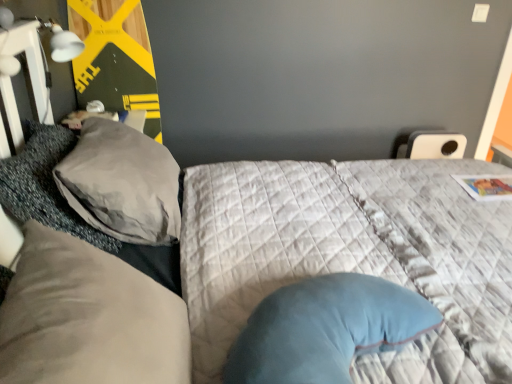
What do you see at coordinates (88, 318) in the screenshot? The image size is (512, 384). I see `suede-like beige pillow at left, which is the third pillow in back-to-front order` at bounding box center [88, 318].

In order to face suede-like beige pillow at left, which is the third pillow in back-to-front order, should I rotate leftwards or rightwards?

You should rotate left by 19.261 degrees.

Image resolution: width=512 pixels, height=384 pixels. What do you see at coordinates (45, 185) in the screenshot? I see `gray textured pillow at left, the second pillow positioned from the back` at bounding box center [45, 185].

Identify the location of matte yellow wood board at upper left. [115, 58].

This screenshot has height=384, width=512. What do you see at coordinates (352, 256) in the screenshot?
I see `velvety blue pillow at center` at bounding box center [352, 256].

The image size is (512, 384). I want to click on velvety blue pillow at center, so click(352, 256).

Measure the distance between point (123, 191) and camera.

Point (123, 191) is 1.27 meters from camera.

What do you see at coordinates (122, 183) in the screenshot? The width and height of the screenshot is (512, 384). I see `gray fabric pillow at left, the first pillow in the back-to-front sequence` at bounding box center [122, 183].

Find the location of a particular element. This screenshot has width=512, height=384. suede-like beige pillow at left, the first pillow from the front is located at coordinates (88, 318).

Is matte yellow wood board at upper left oriented away from velvety blue pillow at center?

matte yellow wood board at upper left is not turned away from velvety blue pillow at center.

From a real-world perspective, is matte yellow wood board at upper left below velvety blue pillow at center?

Incorrect, from a real-world perspective, matte yellow wood board at upper left is higher than velvety blue pillow at center.

Would you say velvety blue pillow at center is part of matte yellow wood board at upper left's contents?

No, velvety blue pillow at center is not surrounded by matte yellow wood board at upper left.

Consider the image. Are matte yellow wood board at upper left and velvety blue pillow at center beside each other?

Result: matte yellow wood board at upper left and velvety blue pillow at center are not in contact.

Is suede-like beige pillow at left, which is the third pillow in back-to-front order, touching gray textured pillow at left, the second pillow positioned from the back?

suede-like beige pillow at left, which is the third pillow in back-to-front order, and gray textured pillow at left, the second pillow positioned from the back, are clearly separated.

In the scene shown: From the image's perspective, is suede-like beige pillow at left, the first pillow from the front, on gray textured pillow at left, which is the second pillow in front-to-back order?

No, from the image's perspective, suede-like beige pillow at left, the first pillow from the front, is not on top of gray textured pillow at left, which is the second pillow in front-to-back order.

Can you confirm if gray textured pillow at left, the second pillow positioned from the back, is shorter than velvety blue pillow at center?

In fact, gray textured pillow at left, the second pillow positioned from the back, may be taller than velvety blue pillow at center.

How distant is gray textured pillow at left, the second pillow positioned from the back, from velvety blue pillow at center?

gray textured pillow at left, the second pillow positioned from the back, and velvety blue pillow at center are 26.71 inches apart.

Considering the relative sizes of gray textured pillow at left, which is the second pillow in front-to-back order, and velvety blue pillow at center in the image provided, is gray textured pillow at left, which is the second pillow in front-to-back order, thinner than velvety blue pillow at center?

Indeed, gray textured pillow at left, which is the second pillow in front-to-back order, has a lesser width compared to velvety blue pillow at center.

From the image's perspective, which is above, gray textured pillow at left, which is the second pillow in front-to-back order, or velvety blue pillow at center?

gray textured pillow at left, which is the second pillow in front-to-back order.

Does point (13, 206) lie behind point (149, 117)?

No, (13, 206) is in front of (149, 117).

Find the location of a particular element. pillow that is the 2nd object located below the matte yellow wood board at upper left (from the image's perspective) is located at coordinates (45, 185).

From the image's perspective, would you say gray textured pillow at left, the second pillow positioned from the back, is positioned over matte yellow wood board at upper left?

No, from the image's perspective, gray textured pillow at left, the second pillow positioned from the back, is not over matte yellow wood board at upper left.

Is gray textured pillow at left, the second pillow positioned from the back, wider than matte yellow wood board at upper left?

Correct, the width of gray textured pillow at left, the second pillow positioned from the back, exceeds that of matte yellow wood board at upper left.

Considering the positions of objects gray fabric pillow at left, the first pillow in the back-to-front sequence, and velvety blue pillow at center in the image provided, who is more to the right, gray fabric pillow at left, the first pillow in the back-to-front sequence, or velvety blue pillow at center?

velvety blue pillow at center is more to the right.

The image size is (512, 384). Find the location of `mattress lying in front of the gray fabric pillow at left, the first pillow in the back-to-front sequence`. mattress lying in front of the gray fabric pillow at left, the first pillow in the back-to-front sequence is located at coordinates (352, 256).

How different are the orientations of gray fabric pillow at left, which appears as the third pillow when viewed from the front, and velvety blue pillow at center in degrees?

The angle between the facing direction of gray fabric pillow at left, which appears as the third pillow when viewed from the front, and the facing direction of velvety blue pillow at center is 1.46 degrees.

Based on the photo, is gray fabric pillow at left, which appears as the third pillow when viewed from the front, bigger or smaller than velvety blue pillow at center?

gray fabric pillow at left, which appears as the third pillow when viewed from the front, is bigger than velvety blue pillow at center.

Locate an element on the screen. the 1st pillow below when counting from the matte yellow wood board at upper left (from the image's perspective) is located at coordinates (122, 183).

Is gray fabric pillow at left, which appears as the third pillow when viewed from the front, positioned with its back to matte yellow wood board at upper left?

gray fabric pillow at left, which appears as the third pillow when viewed from the front, is not turned away from matte yellow wood board at upper left.

Between point (137, 218) and point (126, 24), which one is positioned behind?

The point (126, 24) is farther.

Considering the sizes of gray fabric pillow at left, the first pillow in the back-to-front sequence, and matte yellow wood board at upper left in the image, is gray fabric pillow at left, the first pillow in the back-to-front sequence, taller or shorter than matte yellow wood board at upper left?

Considering their sizes, gray fabric pillow at left, the first pillow in the back-to-front sequence, has less height than matte yellow wood board at upper left.

Considering the relative sizes of matte yellow wood board at upper left and suede-like beige pillow at left, which is the third pillow in back-to-front order, in the image provided, is matte yellow wood board at upper left thinner than suede-like beige pillow at left, which is the third pillow in back-to-front order,?

Yes.

Is point (140, 74) closer to camera compared to point (139, 287)?

No, it is behind (139, 287).

Is matte yellow wood board at upper left turned away from suede-like beige pillow at left, the first pillow from the front?

matte yellow wood board at upper left does not have its back to suede-like beige pillow at left, the first pillow from the front.

This screenshot has height=384, width=512. I want to click on bulletin board above the suede-like beige pillow at left, the first pillow from the front (from a real-world perspective), so click(x=115, y=58).

I want to click on mattress located below the matte yellow wood board at upper left (from the image's perspective), so click(352, 256).

You are a GUI agent. You are given a task and a screenshot of the screen. Output one action in this format:
    pyautogui.click(x=<x>, y=<y>)
    Task: Click on the 2nd pillow positioned below the suede-like beige pillow at left, which is the third pillow in back-to-front order (from a real-world perspective)
    Image resolution: width=512 pixels, height=384 pixels.
    Given the screenshot: What is the action you would take?
    pyautogui.click(x=45, y=185)

Looking at the image, which one is located further to velvety blue pillow at center, gray textured pillow at left, which is the second pillow in front-to-back order, or matte yellow wood board at upper left?

The object further to velvety blue pillow at center is matte yellow wood board at upper left.

From the image, which object appears to be nearer to velvety blue pillow at center, gray fabric pillow at left, the first pillow in the back-to-front sequence, or gray textured pillow at left, which is the second pillow in front-to-back order?

Among the two, gray fabric pillow at left, the first pillow in the back-to-front sequence, is located nearer to velvety blue pillow at center.

From the image, which object appears to be nearer to gray textured pillow at left, which is the second pillow in front-to-back order, suede-like beige pillow at left, which is the third pillow in back-to-front order, or matte yellow wood board at upper left?

Based on the image, suede-like beige pillow at left, which is the third pillow in back-to-front order, appears to be nearer to gray textured pillow at left, which is the second pillow in front-to-back order.

Estimate the real-world distances between objects in this image. Which object is closer to velvety blue pillow at center, gray fabric pillow at left, the first pillow in the back-to-front sequence, or suede-like beige pillow at left, the first pillow from the front?

gray fabric pillow at left, the first pillow in the back-to-front sequence, is closer to velvety blue pillow at center.

When comparing their distances from matte yellow wood board at upper left, does suede-like beige pillow at left, which is the third pillow in back-to-front order, or gray fabric pillow at left, the first pillow in the back-to-front sequence, seem further?

The object further to matte yellow wood board at upper left is suede-like beige pillow at left, which is the third pillow in back-to-front order.

From the image, which object appears to be nearer to gray fabric pillow at left, which appears as the third pillow when viewed from the front, velvety blue pillow at center or suede-like beige pillow at left, the first pillow from the front?

velvety blue pillow at center is closer to gray fabric pillow at left, which appears as the third pillow when viewed from the front.

From the image, which object appears to be nearer to velvety blue pillow at center, suede-like beige pillow at left, which is the third pillow in back-to-front order, or matte yellow wood board at upper left?

suede-like beige pillow at left, which is the third pillow in back-to-front order, is closer to velvety blue pillow at center.

Considering their positions, is gray fabric pillow at left, the first pillow in the back-to-front sequence, positioned further to gray textured pillow at left, which is the second pillow in front-to-back order, than velvety blue pillow at center?

Among the two, velvety blue pillow at center is located further to gray textured pillow at left, which is the second pillow in front-to-back order.

You are a GUI agent. You are given a task and a screenshot of the screen. Output one action in this format:
    pyautogui.click(x=<x>, y=<y>)
    Task: Click on the pillow between gray textured pillow at left, which is the second pillow in front-to-back order, and matte yellow wood board at upper left in the front-back direction
    
    Given the screenshot: What is the action you would take?
    pyautogui.click(x=122, y=183)

This screenshot has width=512, height=384. What are the coordinates of `pillow between gray fabric pillow at left, the first pillow in the back-to-front sequence, and velvety blue pillow at center` in the screenshot? It's located at (88, 318).

Find the location of a particular element. This screenshot has width=512, height=384. mattress between suede-like beige pillow at left, the first pillow from the front, and matte yellow wood board at upper left in the front-back direction is located at coordinates (352, 256).

Image resolution: width=512 pixels, height=384 pixels. I want to click on pillow positioned between suede-like beige pillow at left, the first pillow from the front, and gray fabric pillow at left, the first pillow in the back-to-front sequence, from near to far, so click(45, 185).